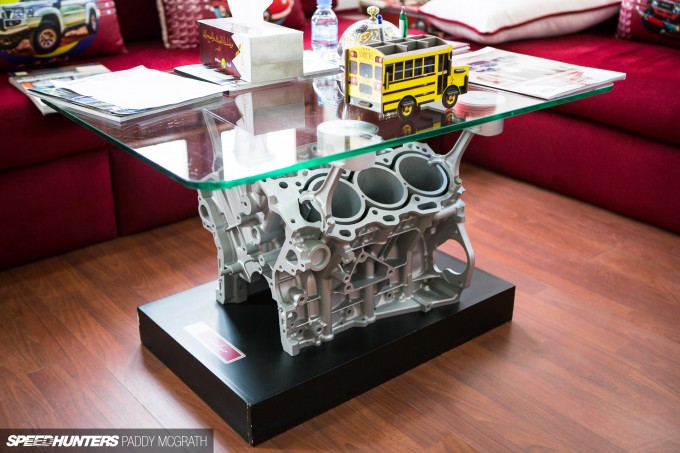
Locate an element on the screen. This screenshot has height=453, width=680. floor is located at coordinates coord(589,229).